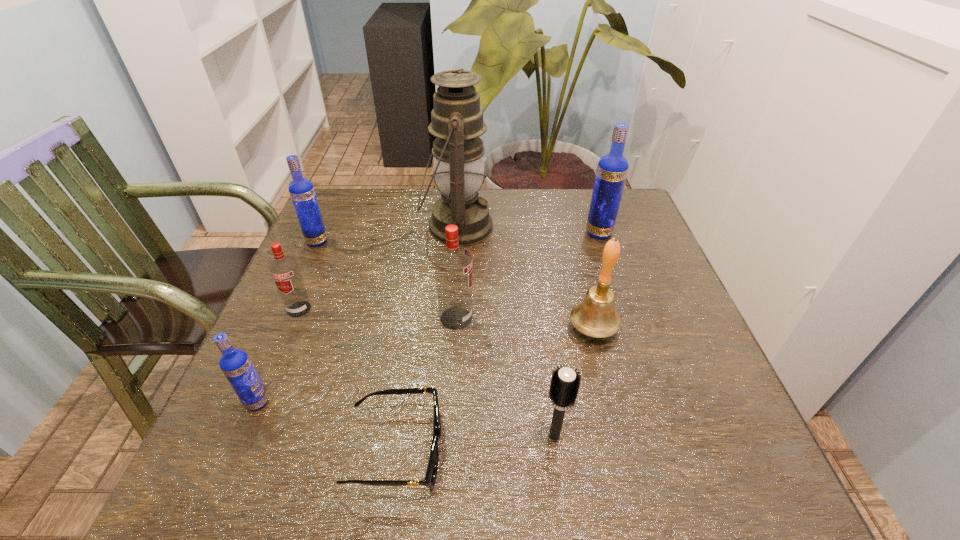
Where is `the tallest object`? The height and width of the screenshot is (540, 960). the tallest object is located at coordinates (457, 122).

Locate an element on the screen. This screenshot has width=960, height=540. the rightmost blue vodka is located at coordinates (612, 169).

This screenshot has width=960, height=540. In order to click on the tallest vodka in this screenshot , I will do point(612,169).

Locate an element on the screen. the second biggest blue vodka is located at coordinates (301, 190).

Identify the location of the right red vodka. [x=453, y=263].

Identify the location of the bigger red vodka. (453, 263).

What are the coordinates of `bell` in the screenshot? It's located at (596, 316).

You are a GUI agent. You are given a task and a screenshot of the screen. Output one action in this format:
    pyautogui.click(x=<x>, y=<y>)
    Task: Click on the smallest blue vodka
    The image size is (960, 540).
    Given the screenshot: What is the action you would take?
    pyautogui.click(x=235, y=364)

Where is `the nearest vodka`? The image size is (960, 540). the nearest vodka is located at coordinates (235, 364).

Find the location of a particular element. This screenshot has height=540, width=960. the left red vodka is located at coordinates (284, 270).